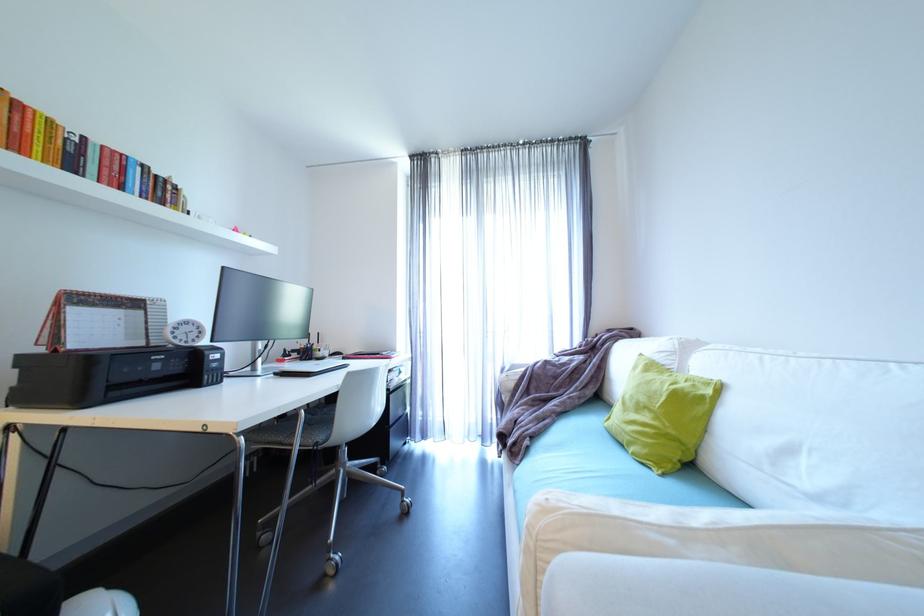
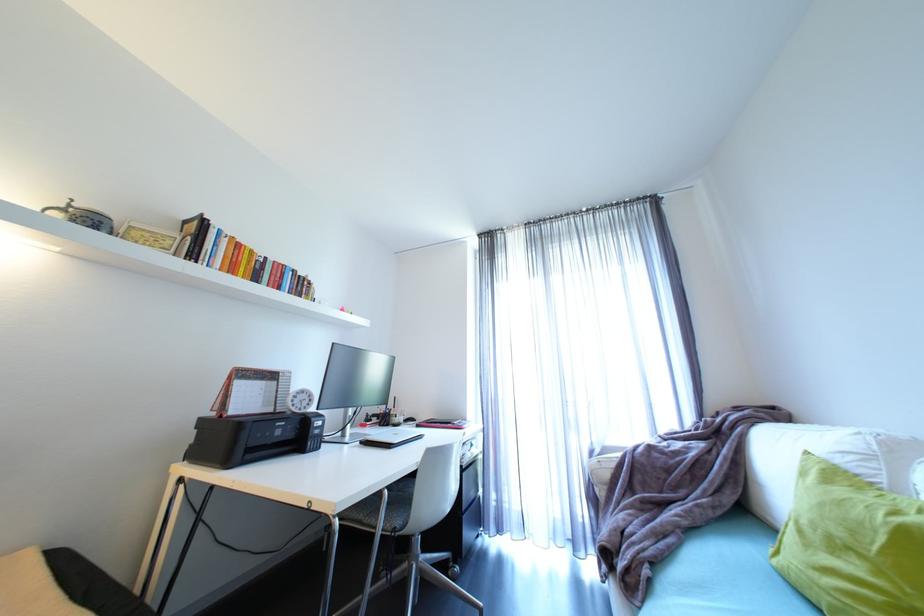
The point at (663, 419) is marked in the first image. Where is the corresponding point in the second image?

(885, 573)